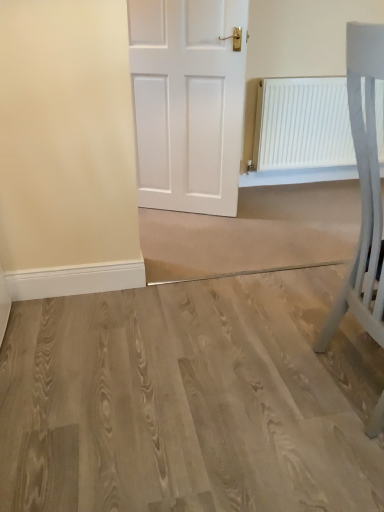
Locate an element on the screen. This screenshot has height=512, width=384. free point below white matte chair at right (from a real-world perspective) is located at coordinates (349, 384).